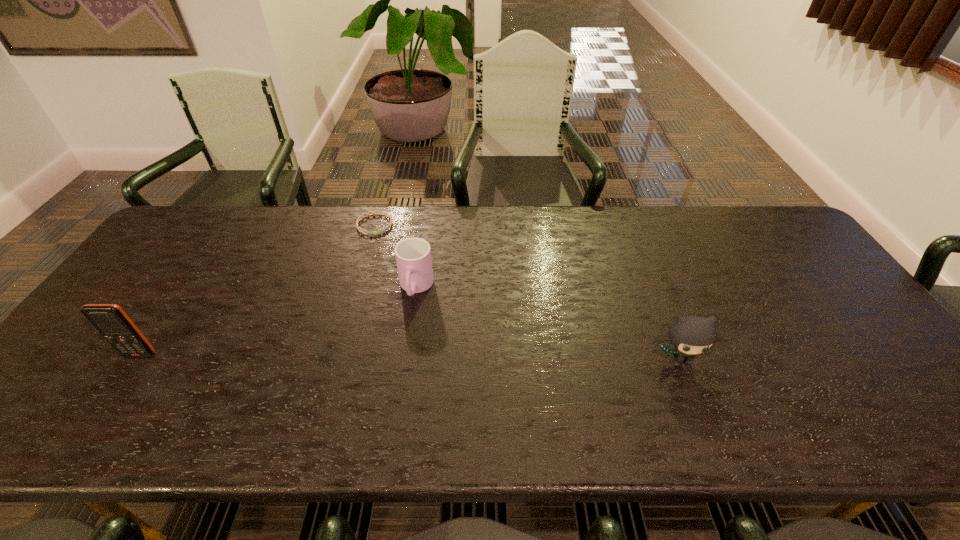
This screenshot has height=540, width=960. I want to click on free location located 0.080m on the surface of the second object from left to right showing star-shaped elements, so click(389, 248).

Locate an element on the screen. vacant space situated on the surface of the second object from left to right showing star-shaped elements is located at coordinates (427, 310).

Where is `vacant region located 0.130m with the handle on the side of the second object from right to left`? The height and width of the screenshot is (540, 960). vacant region located 0.130m with the handle on the side of the second object from right to left is located at coordinates (402, 345).

In order to click on blank space located with the handle on the side of the second object from right to left in this screenshot , I will do `click(404, 338)`.

The height and width of the screenshot is (540, 960). What are the coordinates of `free space located with the handle on the side of the second object from right to left` in the screenshot? It's located at (396, 364).

Where is `object at the far edge`? object at the far edge is located at coordinates (362, 231).

Where is `object that is at the near edge`? object that is at the near edge is located at coordinates (691, 335).

Find the location of a particular element. Image resolution: width=960 pixels, height=540 pixels. object that is at the left edge is located at coordinates (110, 320).

Identify the location of vacant space at the far edge. This screenshot has height=540, width=960. (368, 208).

The height and width of the screenshot is (540, 960). I want to click on free space at the near edge of the desktop, so click(655, 374).